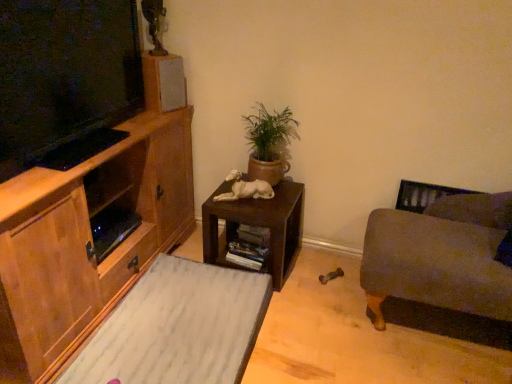
Where is `free space that is to the left of velvet gray couch at right`? free space that is to the left of velvet gray couch at right is located at coordinates (322, 322).